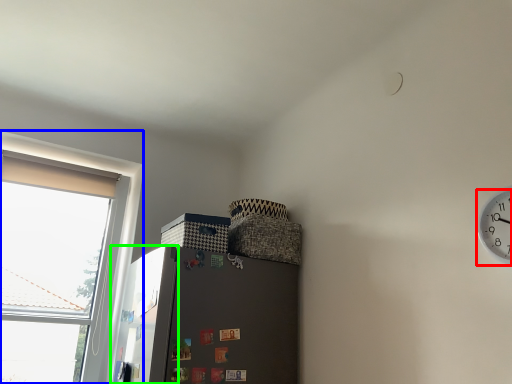
Question: Estimate the real-world distances between objects in this image. Which object is closer to clock (highlighted by a red box), window (highlighted by a blue box) or screen door (highlighted by a green box)?

Choices:
 (A) window
 (B) screen door

Answer: (B)